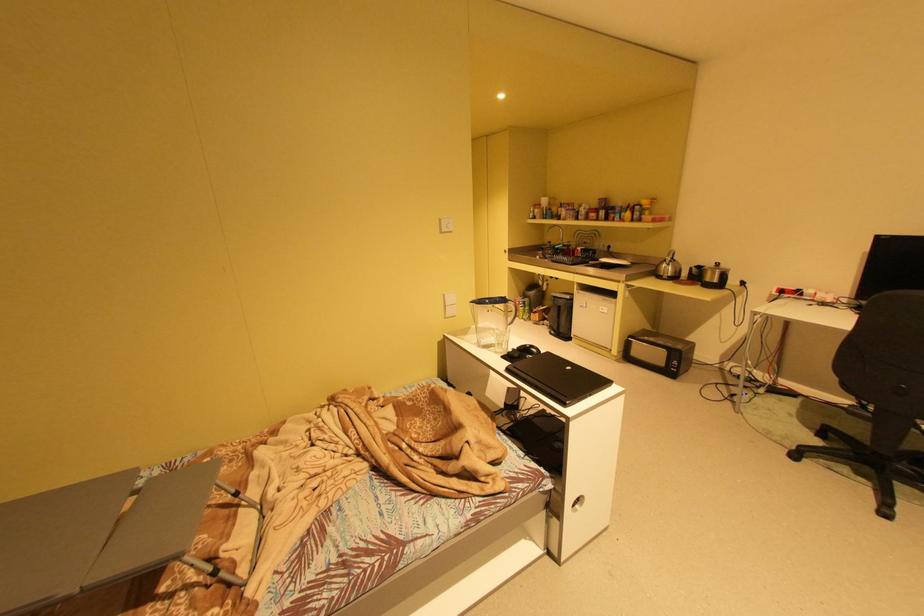
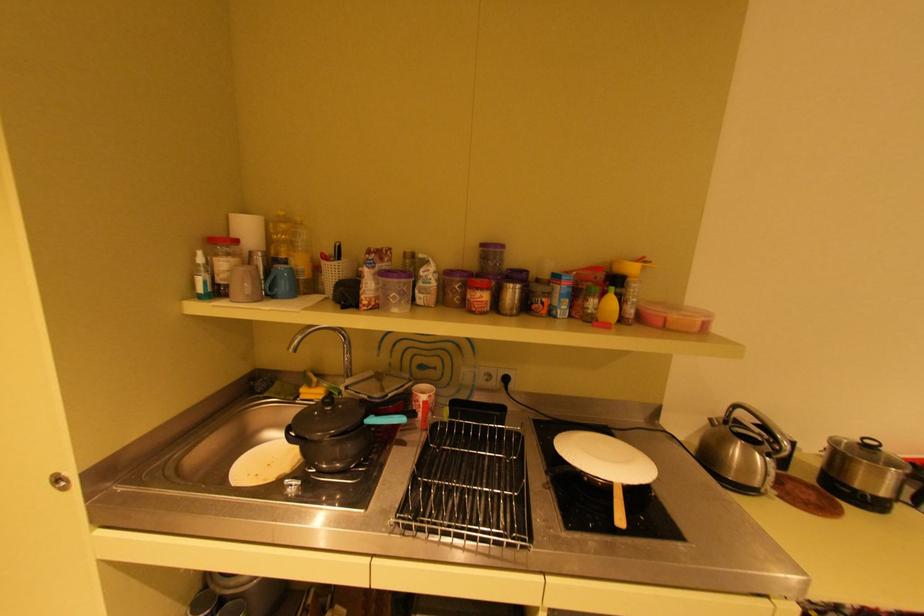
Where in the second image is the point corresponding to [513,252] from the first image?

(65, 479)